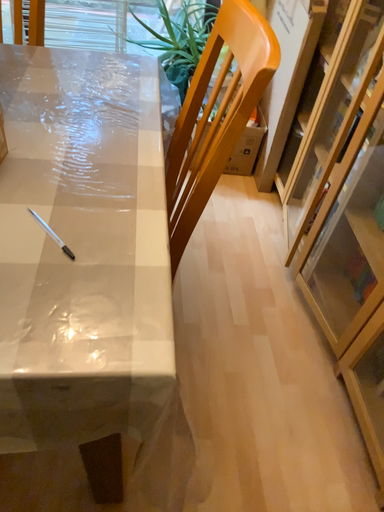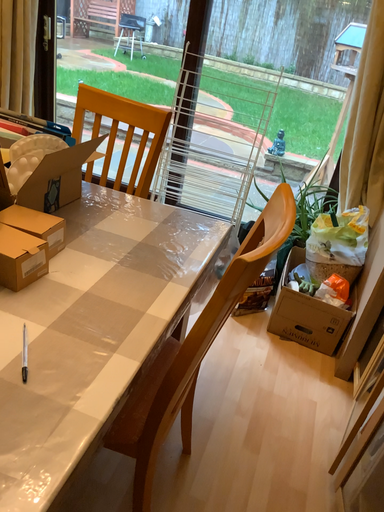
Question: Which way did the camera rotate in the video?

Choices:
 (A) rotated upward
 (B) rotated downward

Answer: (A)